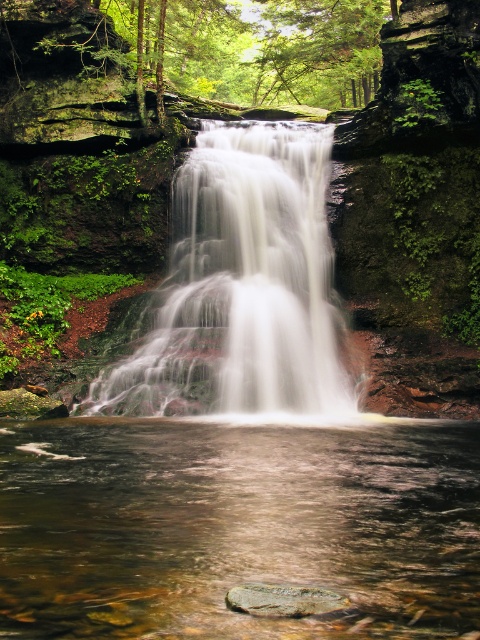
Is translucent water at center taller than smooth brown rock at center?

Indeed, translucent water at center has a greater height compared to smooth brown rock at center.

Locate an element on the screen. The height and width of the screenshot is (640, 480). translucent water at center is located at coordinates (236, 528).

Does translucent water at center have a larger size compared to white smooth waterfall at center?

Actually, translucent water at center might be smaller than white smooth waterfall at center.

Can you confirm if translucent water at center is positioned below white smooth waterfall at center?

Yes.

Is point (445, 586) positioned in front of point (245, 404)?

That is True.

Locate an element on the screen. The height and width of the screenshot is (640, 480). translucent water at center is located at coordinates (236, 528).

Can you confirm if white smooth waterfall at center is shorter than smooth brown rock at center?

Incorrect, white smooth waterfall at center's height does not fall short of smooth brown rock at center's.

Does white smooth waterfall at center have a smaller size compared to smooth brown rock at center?

No.

The width and height of the screenshot is (480, 640). In order to click on white smooth waterfall at center in this screenshot , I will do `click(241, 285)`.